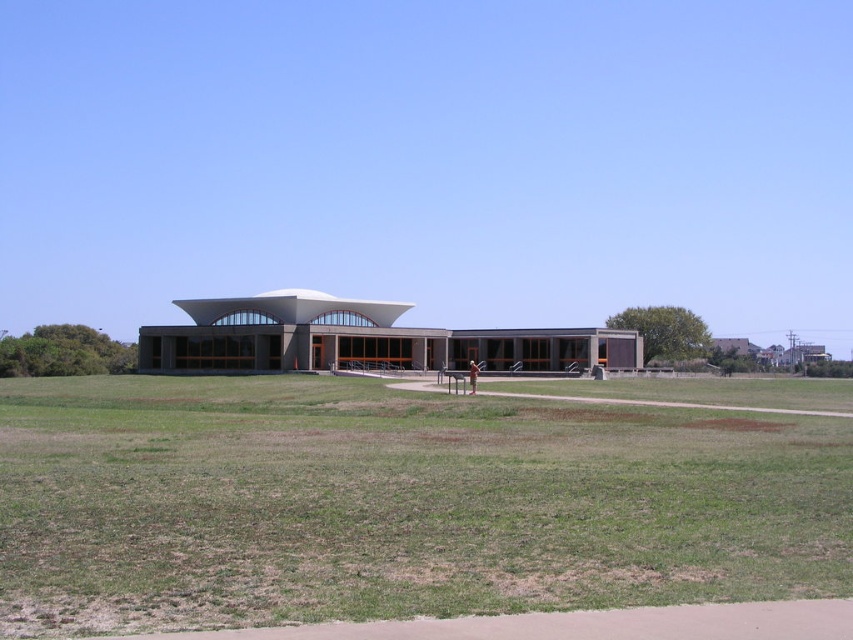
Question: Which point is closer to the camera?

Choices:
 (A) (474, 387)
 (B) (212, 380)

Answer: (A)

Question: Does green grass at center come behind brown textured shorts at center?

Choices:
 (A) no
 (B) yes

Answer: (A)

Question: Is green grass at center above brown textured shorts at center?

Choices:
 (A) no
 (B) yes

Answer: (B)

Question: Among these objects, which one is nearest to the camera?

Choices:
 (A) green grass at center
 (B) brown textured shorts at center

Answer: (A)

Question: Is green grass at center behind brown textured shorts at center?

Choices:
 (A) yes
 (B) no

Answer: (B)

Question: Which of the following is the closest to the observer?

Choices:
 (A) brown textured shorts at center
 (B) green grass at center

Answer: (B)